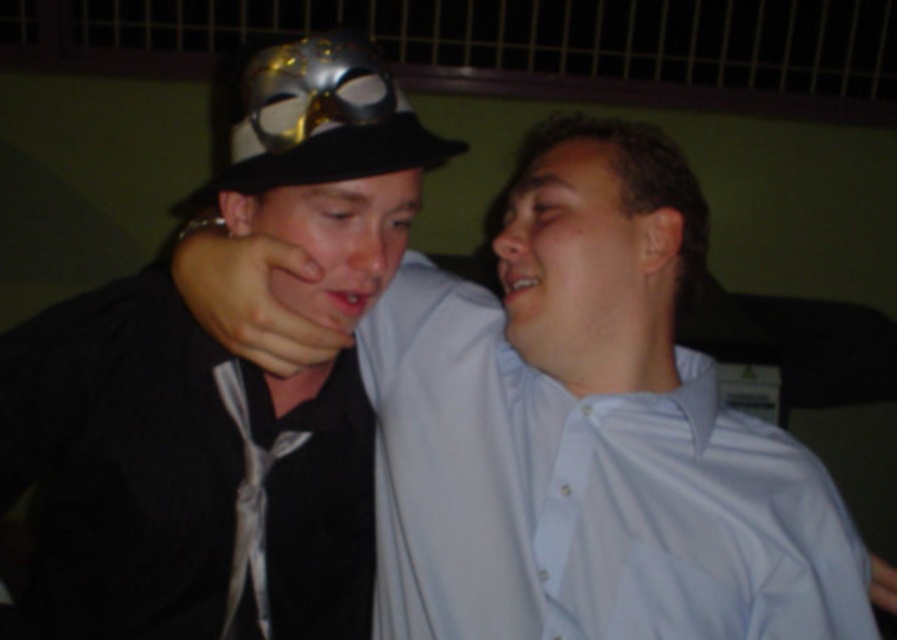
Is smooth skin face at center shorter than silky silver tie at center?

Yes, smooth skin face at center is shorter than silky silver tie at center.

Does smooth skin face at center have a larger size compared to silky silver tie at center?

Correct, smooth skin face at center is larger in size than silky silver tie at center.

I want to click on smooth skin face at center, so click(x=573, y=257).

Identify the location of smooth skin face at center. (573, 257).

Is black felt hat at upper left smaller than silky silver tie at center?

Actually, black felt hat at upper left might be larger than silky silver tie at center.

Based on the photo, who is lower down, black felt hat at upper left or silky silver tie at center?

silky silver tie at center is lower down.

Describe the element at coordinates (318, 120) in the screenshot. Image resolution: width=897 pixels, height=640 pixels. I see `black felt hat at upper left` at that location.

Where is `black felt hat at upper left`? This screenshot has width=897, height=640. black felt hat at upper left is located at coordinates [318, 120].

Consider the image. Does smooth skin face at center appear over black felt hat at upper left?

No, smooth skin face at center is not above black felt hat at upper left.

Based on the photo, who is positioned more to the right, smooth skin face at center or black felt hat at upper left?

smooth skin face at center

Who is more forward, [564,170] or [280,164]?

Point [280,164] is more forward.

Identify the location of smooth skin face at center. This screenshot has height=640, width=897. (573, 257).